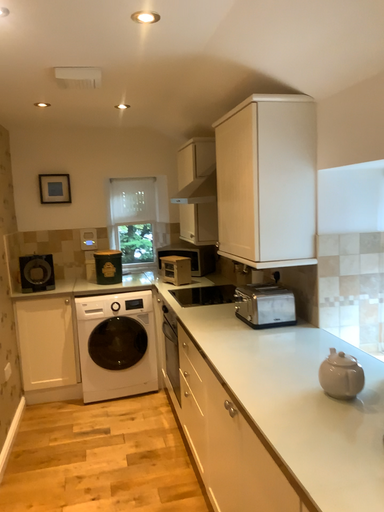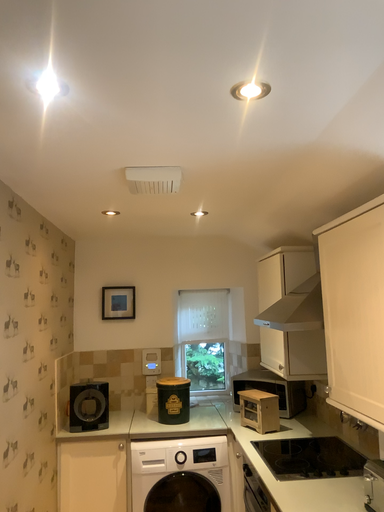
Question: How did the camera likely rotate when shooting the video?

Choices:
 (A) rotated upward
 (B) rotated downward

Answer: (A)